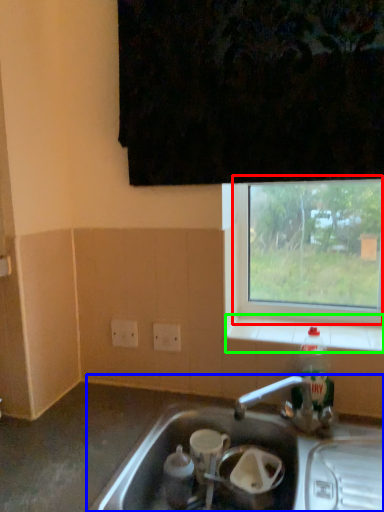
Question: Which object is the farthest from window (highlighted by a red box)? Choose among these: sink (highlighted by a blue box) or window sill (highlighted by a green box).

Choices:
 (A) sink
 (B) window sill

Answer: (A)